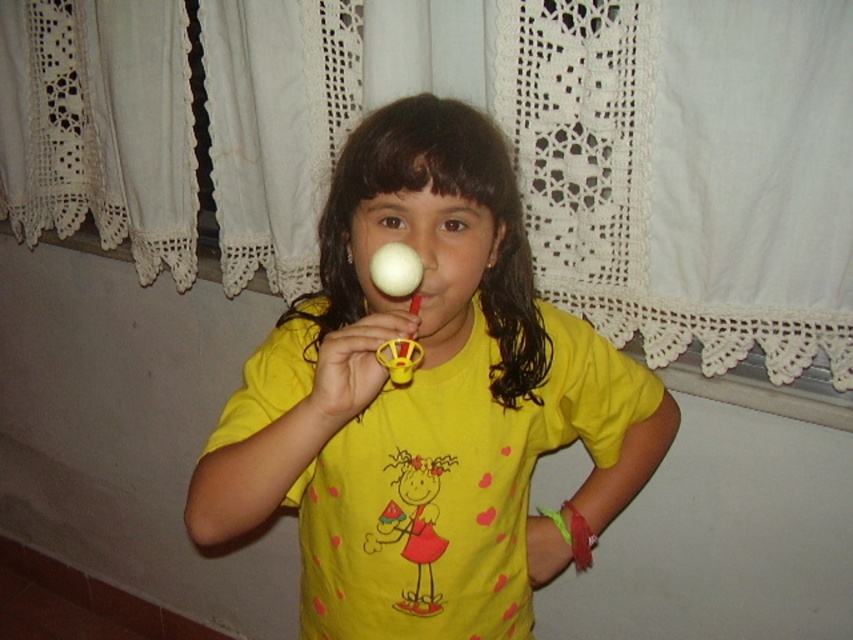
You are a fashion designer analyzing the placement of elements on a childswear design. The design includes a yellow matte shirt at center with a red dress girl holding watermelon slice illustration and pink heart patterns. There is a point marked at coordinates (427, 403). Based on the scene description, can you determine if this point is located on the yellow matte shirt at center?

Yes, the point at coordinates (427, 403) is located on the yellow matte shirt at center according to the description.

The young girl is holding a matte plastic rattle at center in one hand and wearing a yellow matte shirt at center. Which object is bigger?

The yellow matte shirt at center is bigger than the matte plastic rattle at center.

The girl is holding the matte plastic rattle at center in one hand and wearing the yellow matte shirt at center. If she wants to place both items side by side on a small shelf, which item will occupy more space horizontally?

The yellow matte shirt at center will occupy more space horizontally because its width is larger than the matte plastic rattle at center.